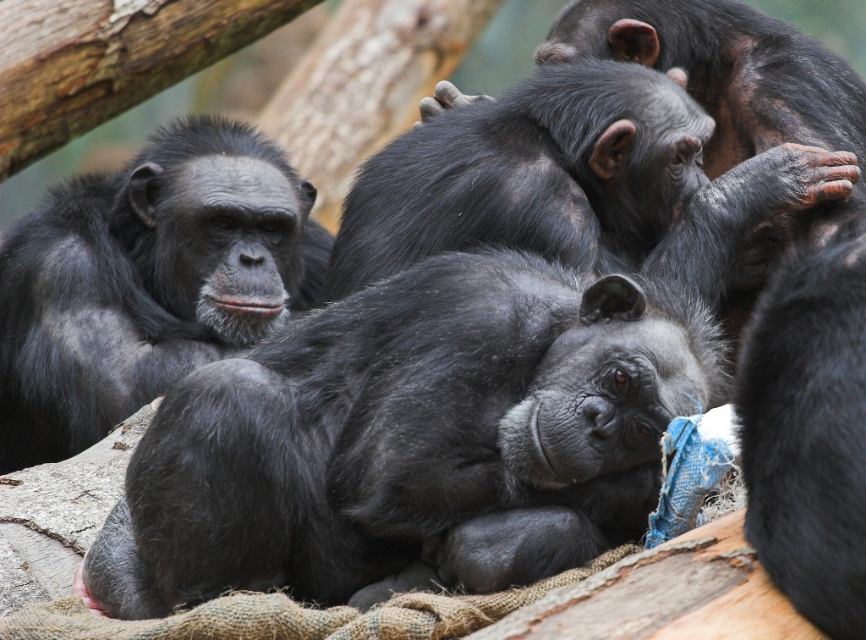
Locate an element on the screen. black fur monkey at center is located at coordinates (412, 440).

Is black fur monkey at center further to camera compared to shiny black monkey at left?

No, it is not.

Describe the element at coordinates (412, 440) in the screenshot. Image resolution: width=866 pixels, height=640 pixels. I see `black fur monkey at center` at that location.

I want to click on black fur monkey at center, so click(x=412, y=440).